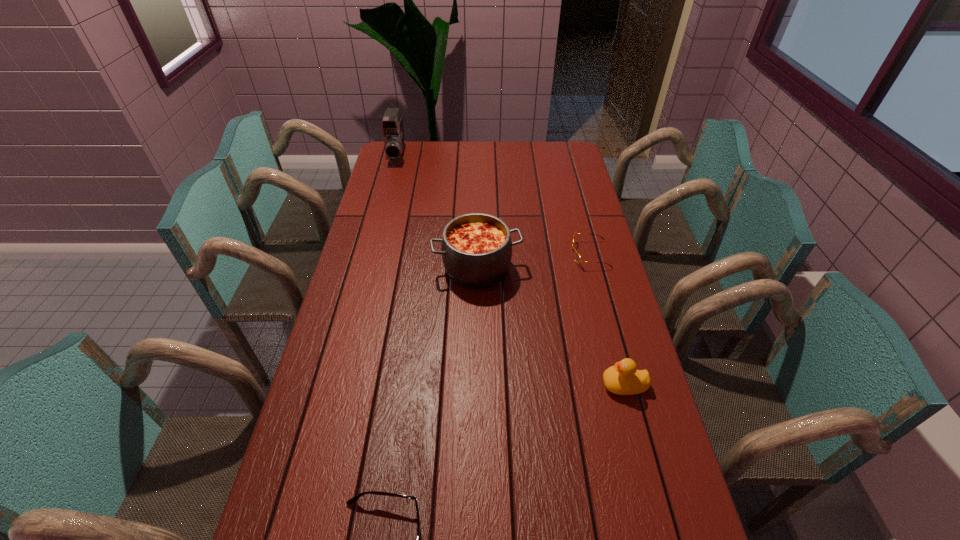
The width and height of the screenshot is (960, 540). In the image, there is a desktop. Find the location of `free space at the left edge`. free space at the left edge is located at coordinates tap(398, 247).

Where is `free space at the right edge`? free space at the right edge is located at coordinates (579, 177).

In the image, there is a desktop. At what (x,y) coordinates should I click in order to perform the action: click on vacant area at the far right corner. Please return your answer as a coordinate pair (x, y). The height and width of the screenshot is (540, 960). Looking at the image, I should click on (551, 149).

The width and height of the screenshot is (960, 540). Find the location of `vacant region between the leftmost object and the right spectacles`. vacant region between the leftmost object and the right spectacles is located at coordinates [x=493, y=205].

Locate an element on the screen. Image resolution: width=960 pixels, height=540 pixels. vacant space in between the second nearest object and the second tallest object is located at coordinates (550, 327).

Image resolution: width=960 pixels, height=540 pixels. Find the location of `vacant area that lies between the third tallest object and the tallest object`. vacant area that lies between the third tallest object and the tallest object is located at coordinates (510, 270).

The width and height of the screenshot is (960, 540). In order to click on free space between the second tallest object and the duck in this screenshot , I will do `click(550, 327)`.

The width and height of the screenshot is (960, 540). What are the coordinates of `free space between the camcorder and the right spectacles` in the screenshot? It's located at (493, 205).

Choose which object is the third nearest neighbor to the fourth shortest object. Please provide its 2D coordinates. Your answer should be formatted as a tuple, i.e. [(x, y)], where the tuple contains the x and y coordinates of a point satisfying the conditions above.

[(392, 124)]

Identify which object is the second closest to the farther spectacles. Please provide its 2D coordinates. Your answer should be formatted as a tuple, i.e. [(x, y)], where the tuple contains the x and y coordinates of a point satisfying the conditions above.

[(623, 379)]